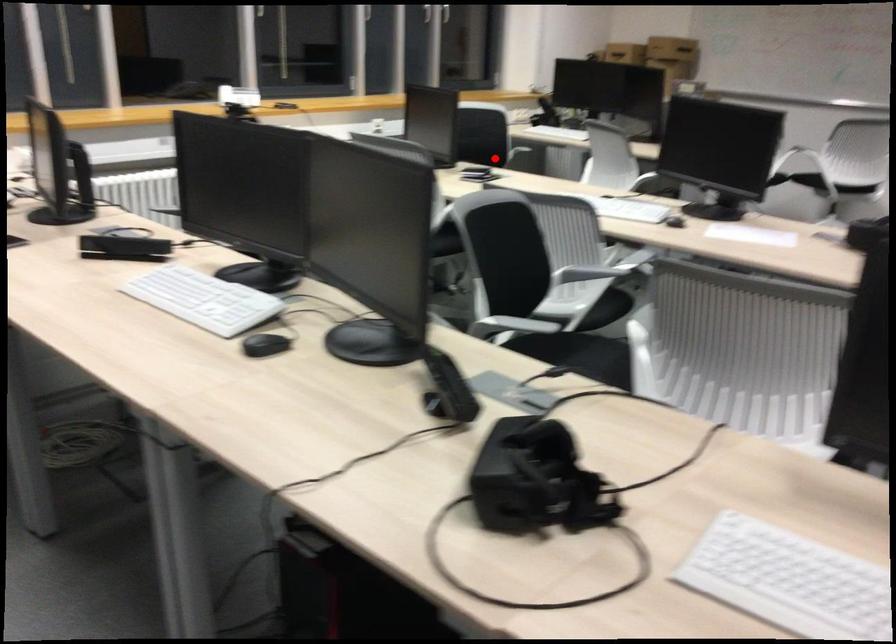
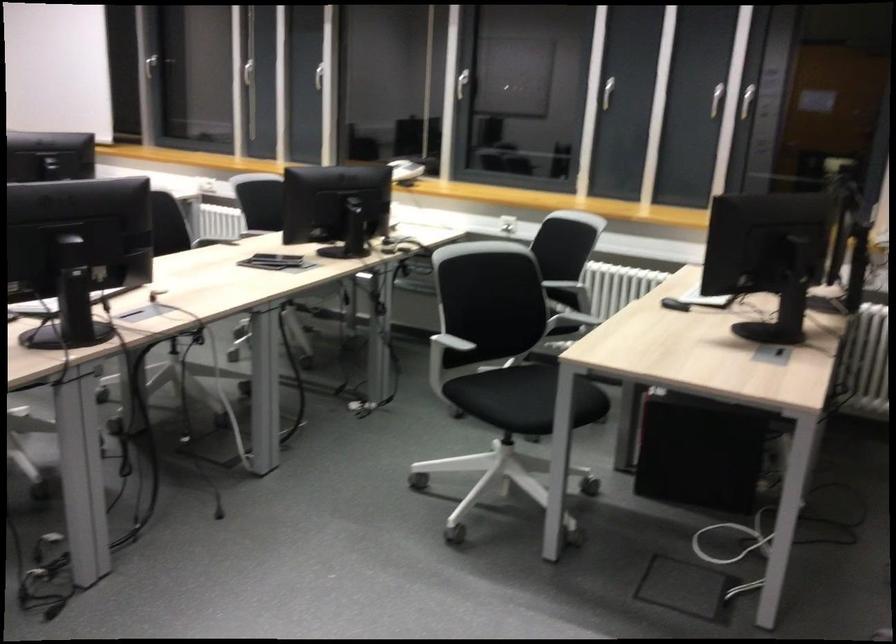
Where in the second image is the point corresponding to the highlighted location from the first image?

(560, 283)